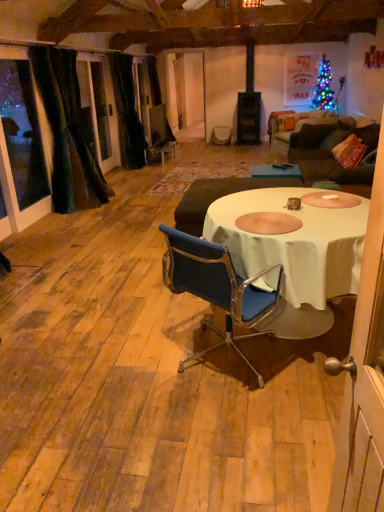
Identify the location of free space in front of blue fabric chair at center. This screenshot has height=512, width=384. (229, 437).